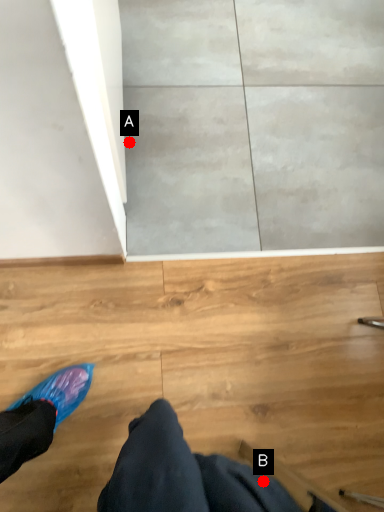
Question: Two points are circled on the image, labeled by A and B beside each circle. Which point appears closest to the camera in this image?

Choices:
 (A) A is closer
 (B) B is closer

Answer: (B)